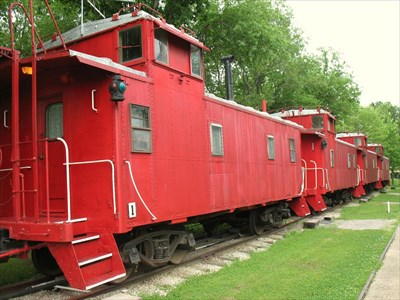
You are a GUI agent. You are given a task and a screenshot of the screen. Output one action in this format:
    pyautogui.click(x=<x>, y=<y>)
    Task: Click on the stair
    The width and height of the screenshot is (400, 300).
    Given the screenshot: What is the action you would take?
    pyautogui.click(x=95, y=260)